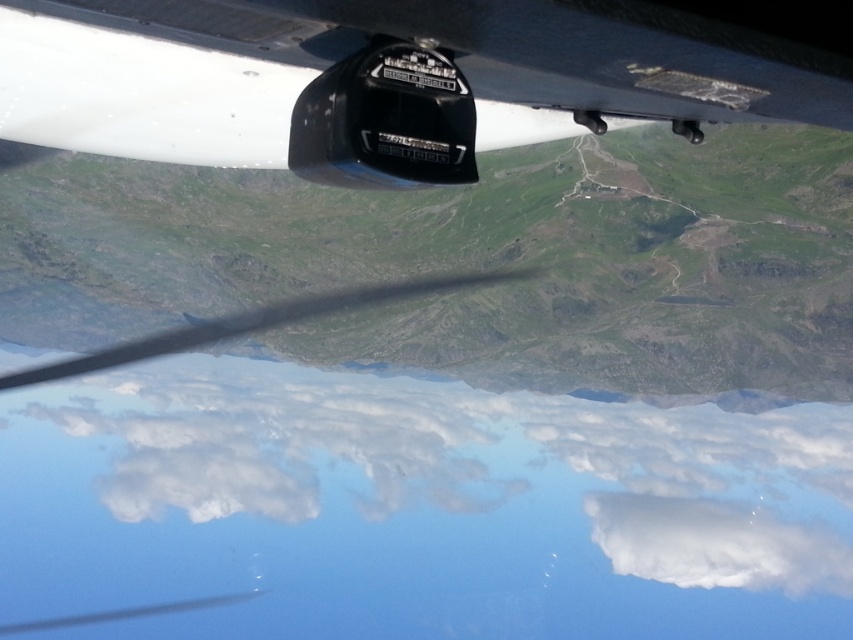
You are a passenger on the aircraft and want to know if the point at coordinates point [709,579] is closer to you than point point [331,97]. Can you determine this based on the view from your window?

Point point [709,579] is behind point point [331,97], so it is farther away from you. Therefore, point point [331,97] is closer to you than point point [709,579].

You are a pilot checking the instruments. You notice the white fluffy cloud at center and the matte black sensor at center. Which object is closer to you?

The white fluffy cloud at center is closer to you because the matte black sensor at center is behind it.

You are a pilot checking the aircraft instruments. You notice the white fluffy cloud at center and the matte black sensor at center. Which object is closer to the aircraft?

The white fluffy cloud at center is positioned under the matte black sensor at center, meaning the matte black sensor at center is closer to the aircraft.